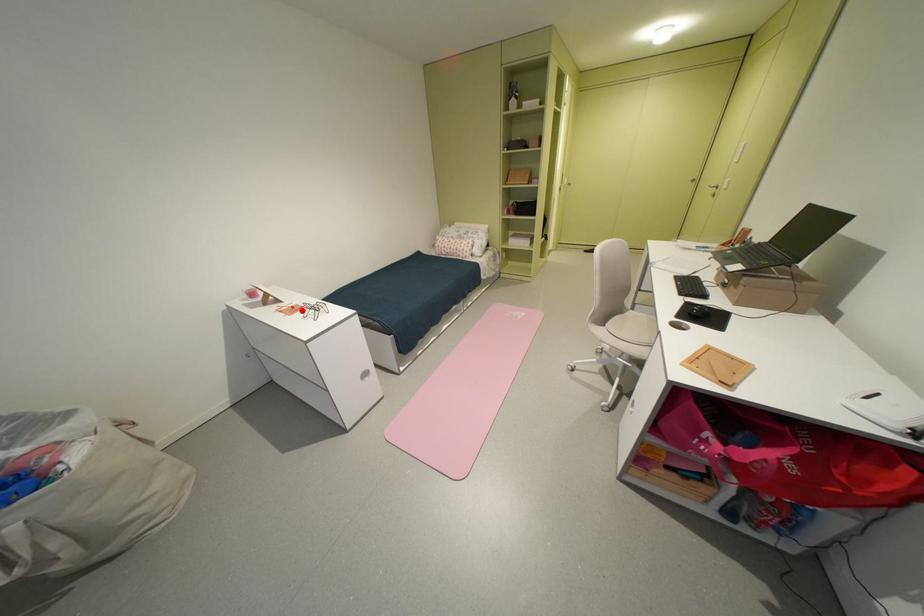
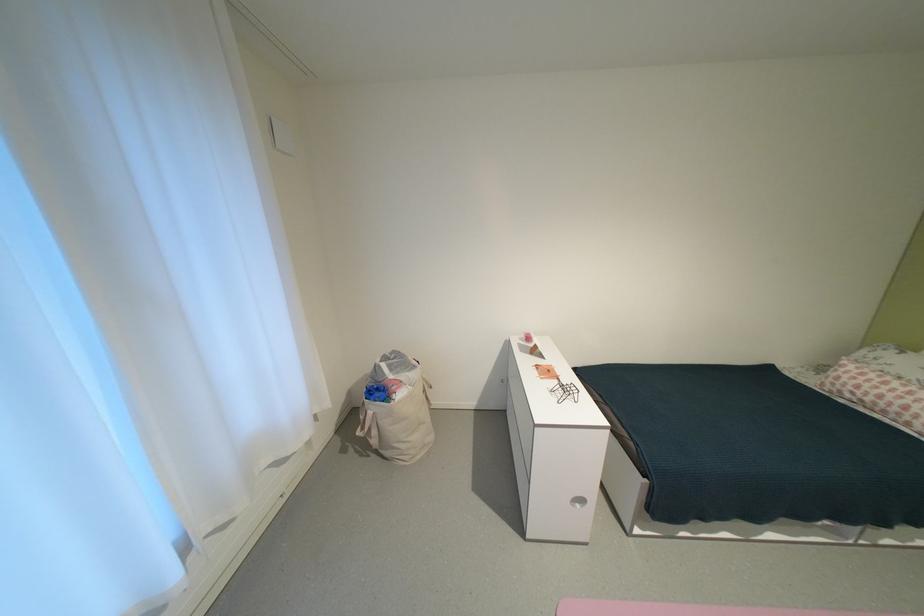
Where in the second image is the point corresponding to the highlighted location from the first image?

(556, 374)